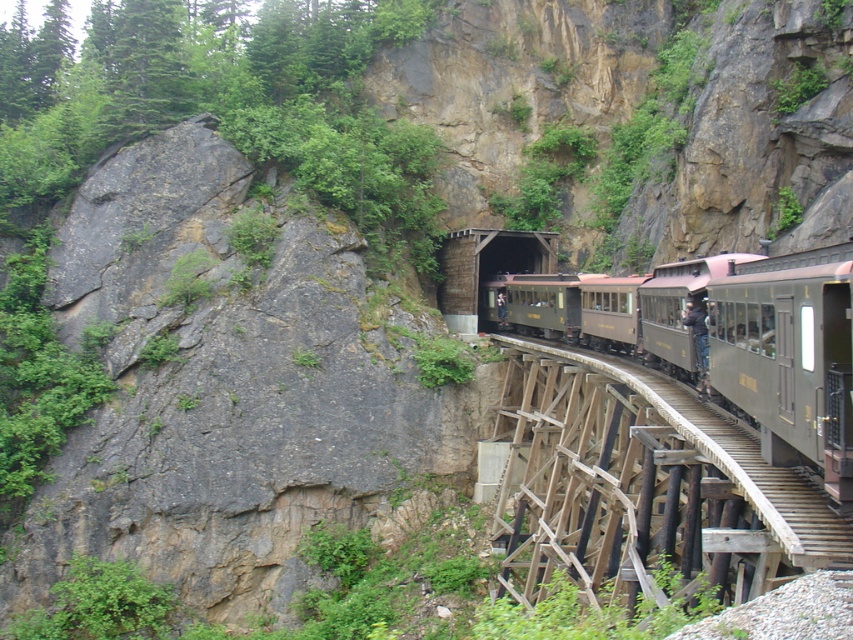
Question: Can you confirm if matte black train car at center is positioned to the left of green wooden bridge at center?

Choices:
 (A) yes
 (B) no

Answer: (B)

Question: Which point is farther to the camera?

Choices:
 (A) (618, 435)
 (B) (459, 307)
 (C) (804, 288)

Answer: (B)

Question: Is wooden at center bigger than matte black train car at center?

Choices:
 (A) no
 (B) yes

Answer: (A)

Question: Which of these objects is positioned farthest from the wooden at center?

Choices:
 (A) green wooden bridge at center
 (B) matte black train car at center

Answer: (A)

Question: Does matte black train car at center appear on the right side of green wooden bridge at center?

Choices:
 (A) yes
 (B) no

Answer: (A)

Question: Estimate the real-world distances between objects in this image. Which object is farther from the green wooden bridge at center?

Choices:
 (A) matte black train car at center
 (B) wooden at center

Answer: (A)